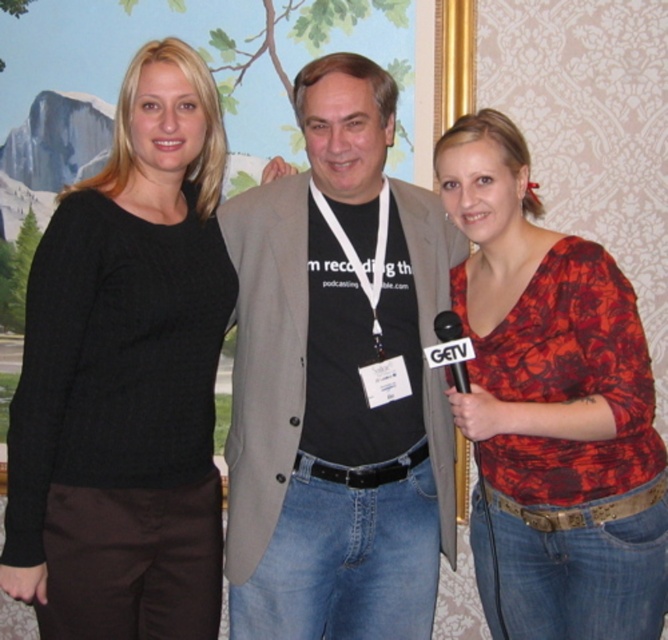
Question: Does black sweater at left appear over black cotton t-shirt at center?

Choices:
 (A) yes
 (B) no

Answer: (A)

Question: Does black cotton t-shirt at center have a greater width compared to floral print shirt at center?

Choices:
 (A) no
 (B) yes

Answer: (B)

Question: Does black cotton t-shirt at center appear under floral print shirt at center?

Choices:
 (A) no
 (B) yes

Answer: (A)

Question: Which point appears farthest from the camera in this image?

Choices:
 (A) (440, 422)
 (B) (528, 627)

Answer: (A)

Question: Which of the following is the closest to the observer?

Choices:
 (A) black cotton t-shirt at center
 (B) black sweater at left
 (C) floral print shirt at center

Answer: (B)

Question: Estimate the real-world distances between objects in this image. Which object is farther from the floral print shirt at center?

Choices:
 (A) black sweater at left
 (B) black cotton t-shirt at center

Answer: (A)